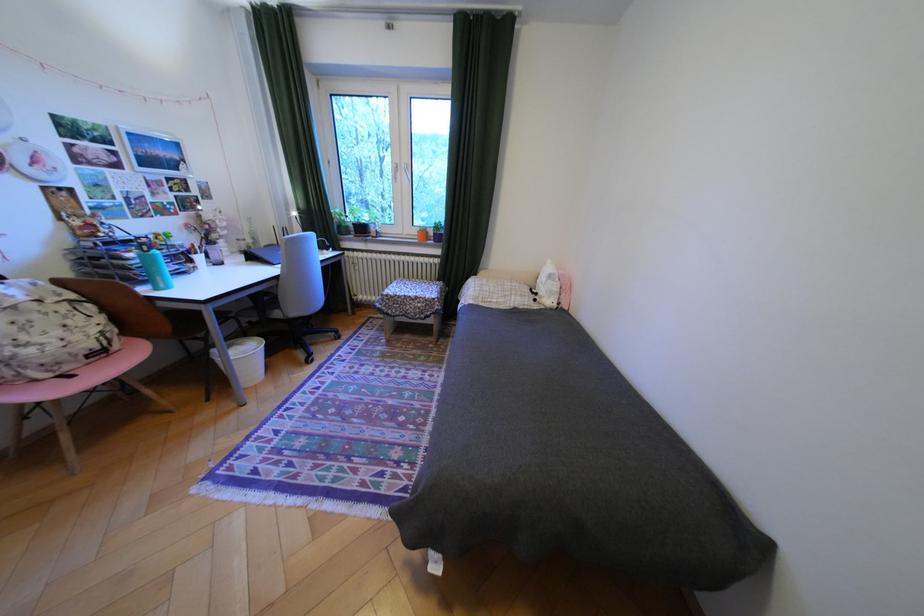
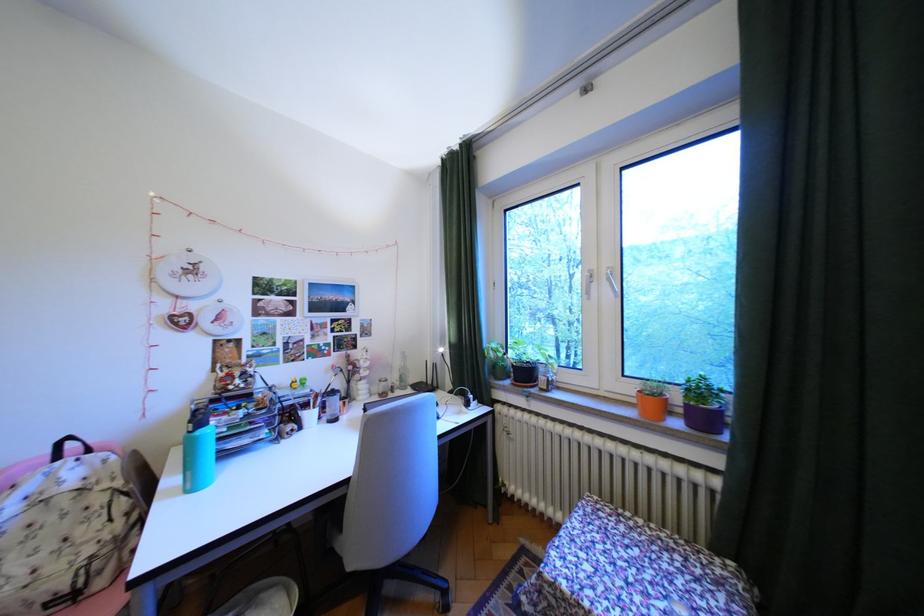
In the second image, find the point that corresponds to [49,317] in the first image.

(65, 519)